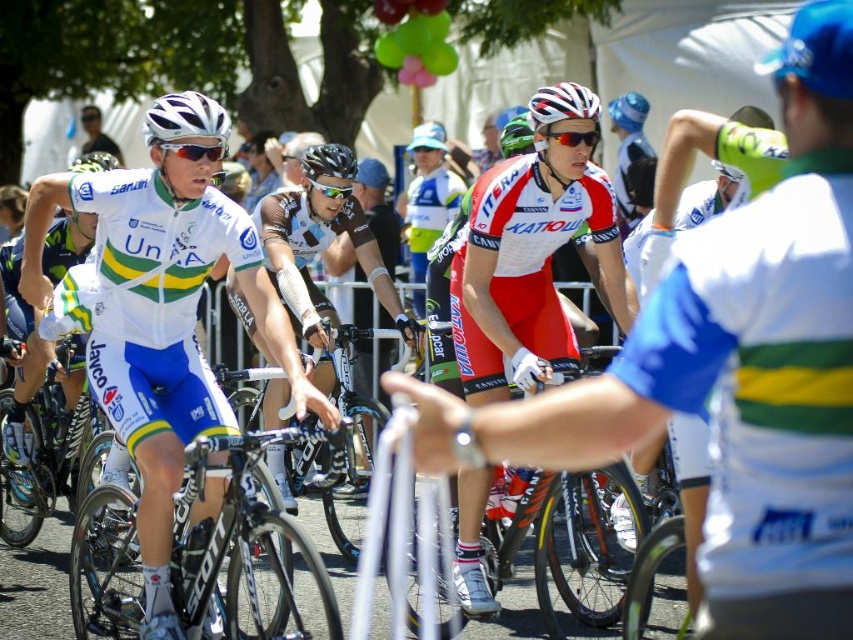
Question: Which object appears farthest from the camera in this image?

Choices:
 (A) black matte bicycle helmet at center
 (B) white matte jersey at center
 (C) white matte bicycle helmet at center
 (D) silver metallic bicycle at center

Answer: (A)

Question: Which point is farther to the camera?

Choices:
 (A) white matte jersey at center
 (B) black matte bicycle helmet at center

Answer: (B)

Question: Is white matte jersey at center bigger than silver metallic bicycle at center?

Choices:
 (A) no
 (B) yes

Answer: (B)

Question: Is white matte bicycle helmet at upper center smaller than black matte bicycle helmet at center?

Choices:
 (A) no
 (B) yes

Answer: (B)

Question: Which of these objects is positioned closest to the white matte bicycle helmet at center?

Choices:
 (A) silver metallic bicycle at center
 (B) black matte bicycle helmet at center
 (C) white matte jersey at center
 (D) white matte bicycle helmet at upper center

Answer: (D)

Question: Can you confirm if white matte bicycle helmet at center is positioned to the left of black matte bicycle helmet at center?

Choices:
 (A) yes
 (B) no

Answer: (B)